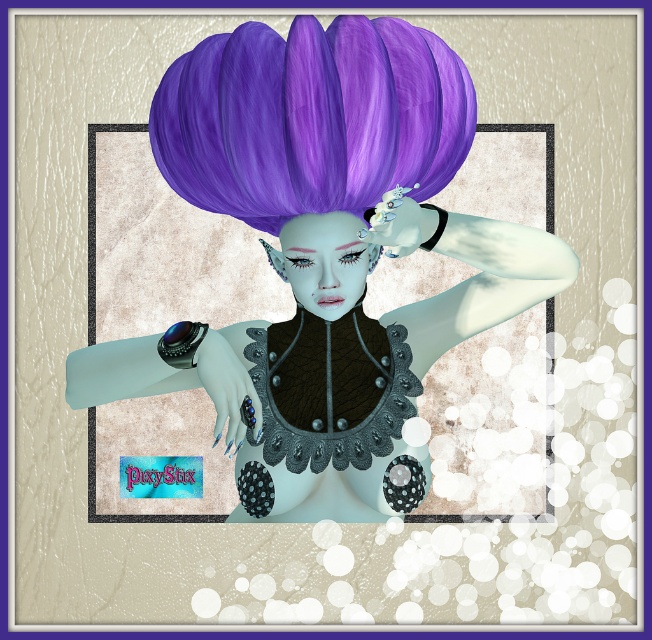
You are an artist creating a fantasy character. You have two options for the character hairdo, the matte purple wig at upper center and the purple matte wig at upper center. Which one is taller?

The matte purple wig at upper center is much taller as purple matte wig at upper center.

You are an artist trying to sketch this character. You need to know the spatial relationship between the purple matte wig at upper center and the satin black corset at center. Which one is positioned higher?

The purple matte wig at upper center is positioned higher than the satin black corset at center.

You are an artist sketching the fantasy character and need to position the purple matte wig at upper center and the satin black corset at center in your drawing. Based on the scene, which object is positioned to the left of the other?

→ The purple matte wig at upper center is to the left of the satin black corset at center.